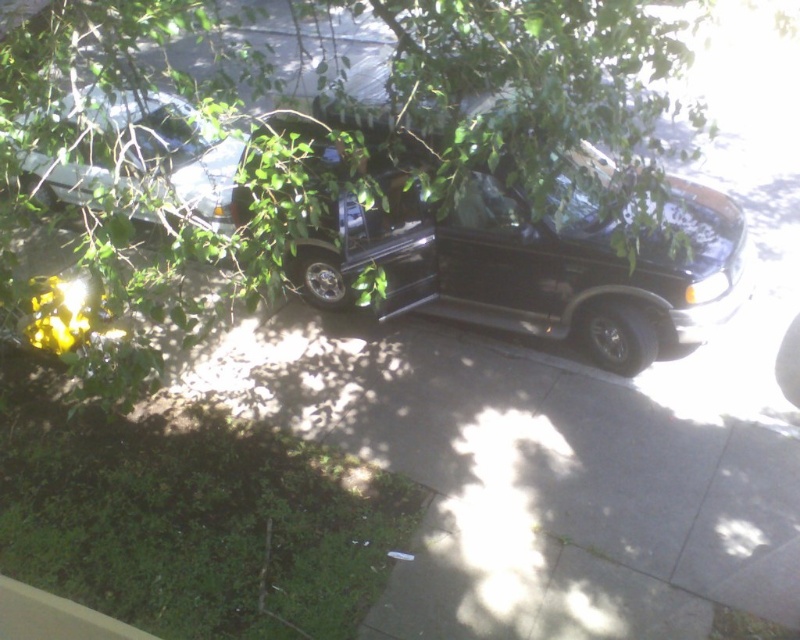
Does point (156, 104) come farther from viewer compared to point (2, 634)?

Yes, point (156, 104) is behind point (2, 634).

From the picture: Does metallic silver car at upper left appear on the left side of gray concrete curb at lower left?

Indeed, metallic silver car at upper left is positioned on the left side of gray concrete curb at lower left.

Is point (229, 161) closer to camera compared to point (61, 612)?

No, it is behind (61, 612).

The height and width of the screenshot is (640, 800). Identify the location of metallic silver car at upper left. coord(166,147).